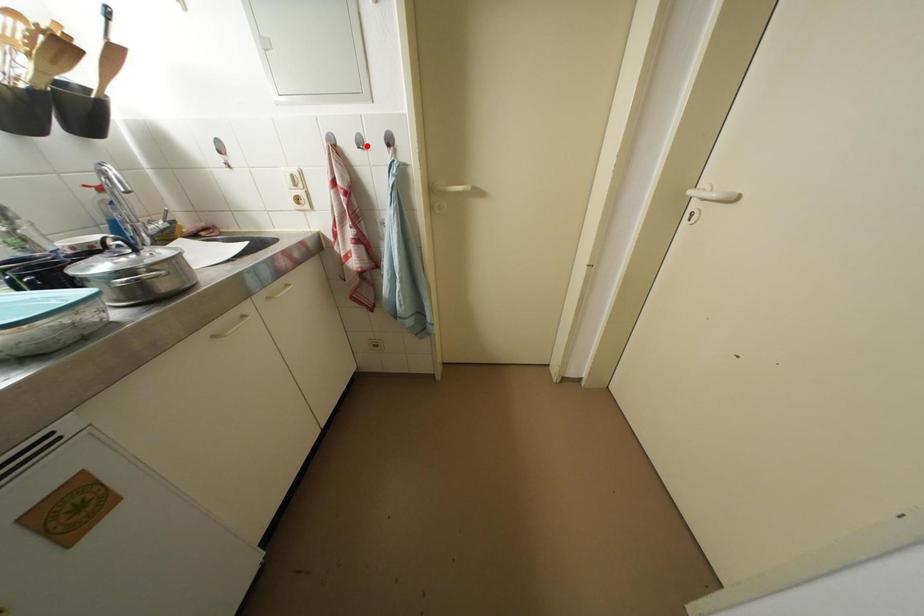
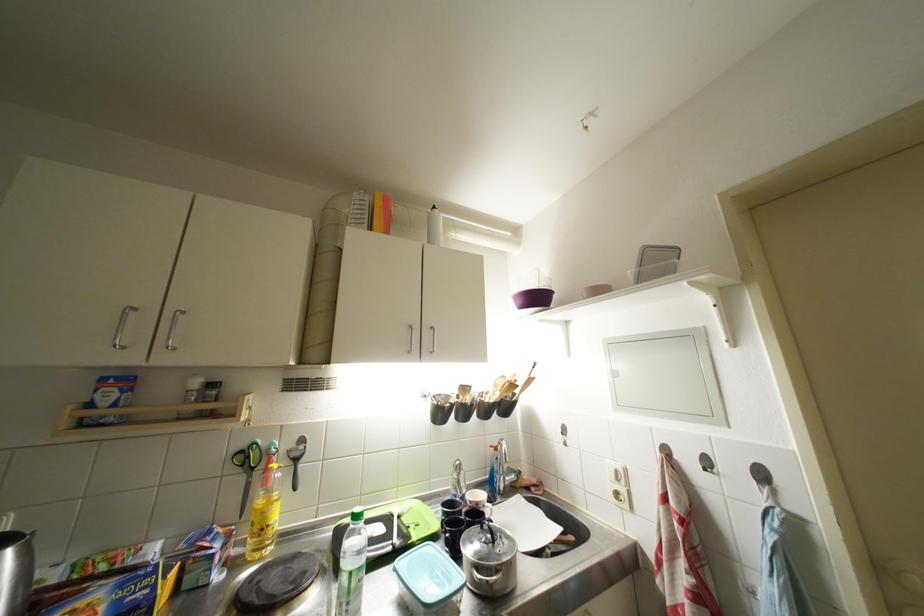
Where in the second image is the point corresponding to the highlighted location from the first image?

(714, 467)